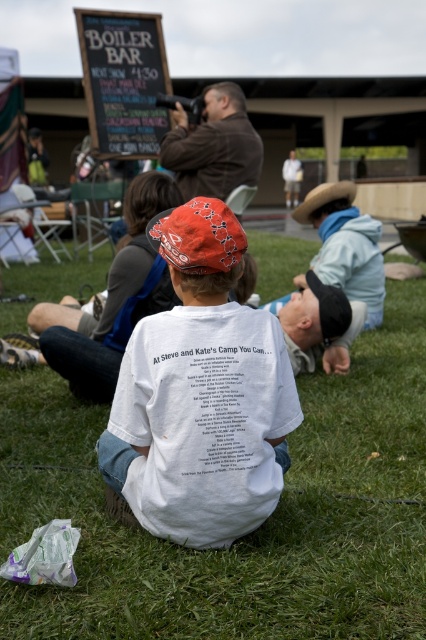
Question: Is green grass at center thinner than white cotton shirt at center?

Choices:
 (A) no
 (B) yes

Answer: (A)

Question: Which of these objects is positioned closest to the green grass at center?

Choices:
 (A) white cotton shirt at center
 (B) chalkboard sign at upper left

Answer: (A)

Question: Among these objects, which one is farthest from the camera?

Choices:
 (A) green grass at center
 (B) white cotton shirt at center
 (C) chalkboard sign at upper left

Answer: (C)

Question: Does green grass at center appear on the left side of white cotton shirt at center?

Choices:
 (A) no
 (B) yes

Answer: (B)

Question: Which object is the closest to the white cotton shirt at center?

Choices:
 (A) chalkboard sign at upper left
 (B) green grass at center

Answer: (B)

Question: Is green grass at center bigger than white cotton shirt at center?

Choices:
 (A) yes
 (B) no

Answer: (A)